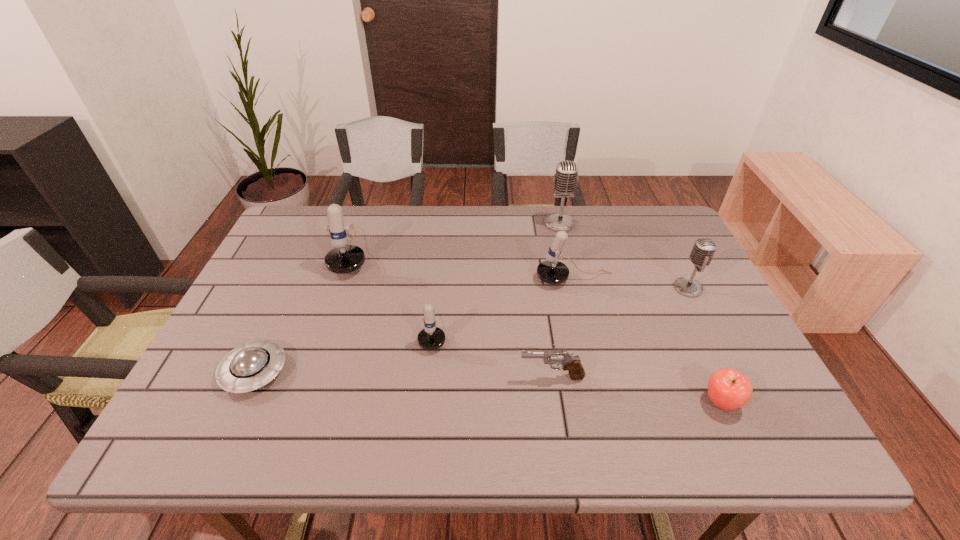
Identify the location of vacant space situated at the barrel of the gray pistol. (430, 377).

I want to click on vacant region located 0.320m at the barrel of the gray pistol, so click(x=375, y=377).

Image resolution: width=960 pixels, height=540 pixels. In order to click on free space located on the right of the gray saucer in this screenshot , I will do `click(446, 372)`.

I want to click on object situated at the near edge, so click(728, 389).

This screenshot has width=960, height=540. I want to click on object that is at the left edge, so click(x=252, y=365).

What are the coordinates of `microphone that is at the right edge` in the screenshot? It's located at (703, 250).

Identify the location of apple at the right edge. This screenshot has height=540, width=960. (728, 389).

Locate an element on the screen. This screenshot has height=540, width=960. object located in the near right corner section of the desktop is located at coordinates (728, 389).

In the image, there is a desktop. Where is `vacant region at the far edge`? vacant region at the far edge is located at coordinates (553, 240).

I want to click on vacant position at the near edge of the desktop, so click(x=334, y=447).